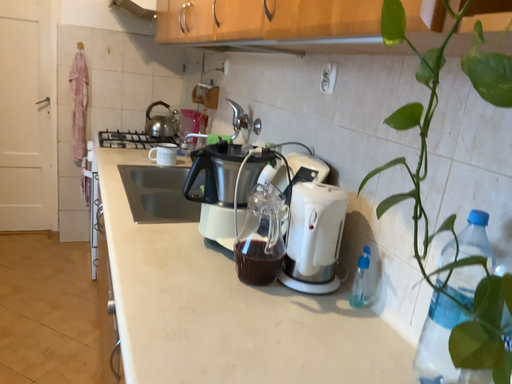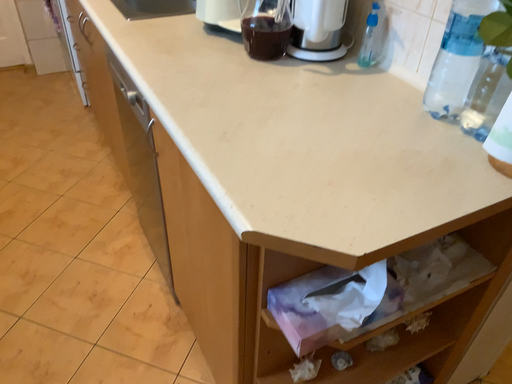
Question: How did the camera likely rotate when shooting the video?

Choices:
 (A) rotated downward
 (B) rotated upward

Answer: (A)